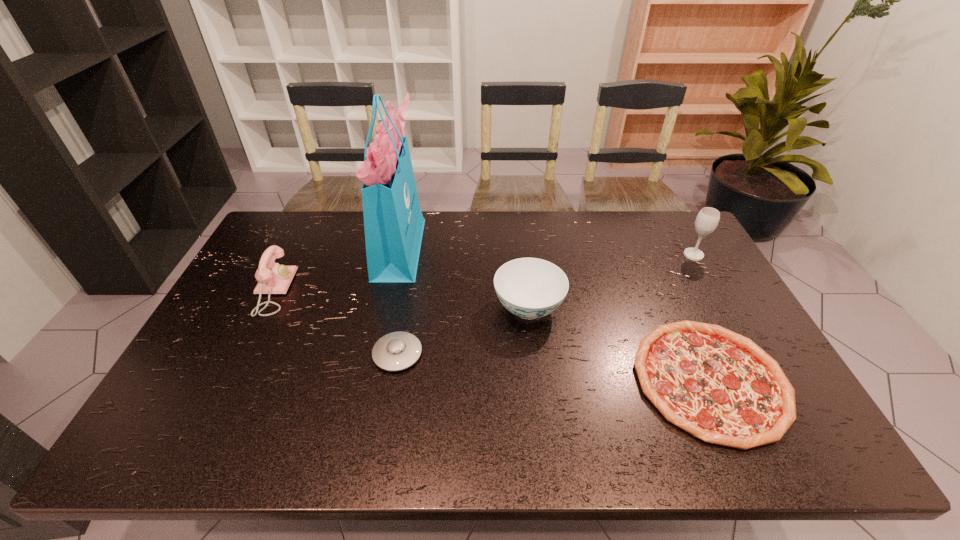
Where is `vacant space at the far edge of the desktop`? The width and height of the screenshot is (960, 540). vacant space at the far edge of the desktop is located at coordinates (474, 242).

Where is `vacant space at the near edge of the desktop`? The width and height of the screenshot is (960, 540). vacant space at the near edge of the desktop is located at coordinates (226, 422).

Identify the location of free space at the left edge of the desktop. (234, 399).

The height and width of the screenshot is (540, 960). Find the location of `free space at the far right corner of the desktop`. free space at the far right corner of the desktop is located at coordinates (663, 228).

Where is `free point between the saucer and the chinaware`? free point between the saucer and the chinaware is located at coordinates (463, 331).

Locate an element on the screen. This screenshot has width=960, height=540. unoccupied area between the leftmost object and the pizza is located at coordinates (492, 335).

Find the location of `vacant point located between the shortest object and the wineglass`. vacant point located between the shortest object and the wineglass is located at coordinates 702,318.

Where is `vacant area between the pizza and the chinaware`? Image resolution: width=960 pixels, height=540 pixels. vacant area between the pizza and the chinaware is located at coordinates (619, 344).

Locate an element on the screen. Image resolution: width=960 pixels, height=540 pixels. free space between the shopping bag and the third object from right to left is located at coordinates 464,277.

The width and height of the screenshot is (960, 540). I want to click on free point between the saucer and the shortest object, so click(x=554, y=367).